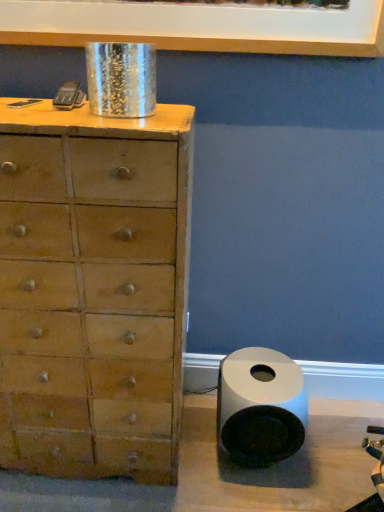
I want to click on free space in front of white glossy speaker at lower right, so click(x=253, y=497).